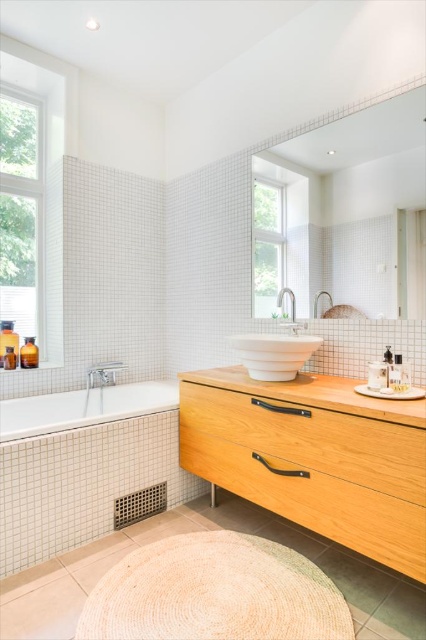
Does clear glass window at upper center have a lesser width compared to white glossy bathtub at lower left?

Indeed, clear glass window at upper center has a lesser width compared to white glossy bathtub at lower left.

Between point (293, 298) and point (40, 429), which one is positioned behind?

Point (293, 298)

Locate an element on the screen. clear glass window at upper center is located at coordinates (279, 236).

Can you confirm if white glossy sink at center is smaller than satin nickel faucet at upper center?

No.

Can you confirm if white glossy sink at center is positioned below satin nickel faucet at upper center?

Indeed, white glossy sink at center is positioned under satin nickel faucet at upper center.

This screenshot has width=426, height=640. I want to click on white glossy sink at center, so click(273, 355).

The width and height of the screenshot is (426, 640). I want to click on white glossy sink at center, so click(273, 355).

Who is more distant from viewer, (20, 428) or (316, 307)?

The point (20, 428) is behind.

Is the position of white glossy bathtub at lower left more distant than that of satin nickel faucet at upper center?

Yes, white glossy bathtub at lower left is behind satin nickel faucet at upper center.

This screenshot has width=426, height=640. I want to click on white glossy bathtub at lower left, so click(x=83, y=406).

Locate an element on the screen. This screenshot has width=426, height=640. white glossy bathtub at lower left is located at coordinates (83, 406).